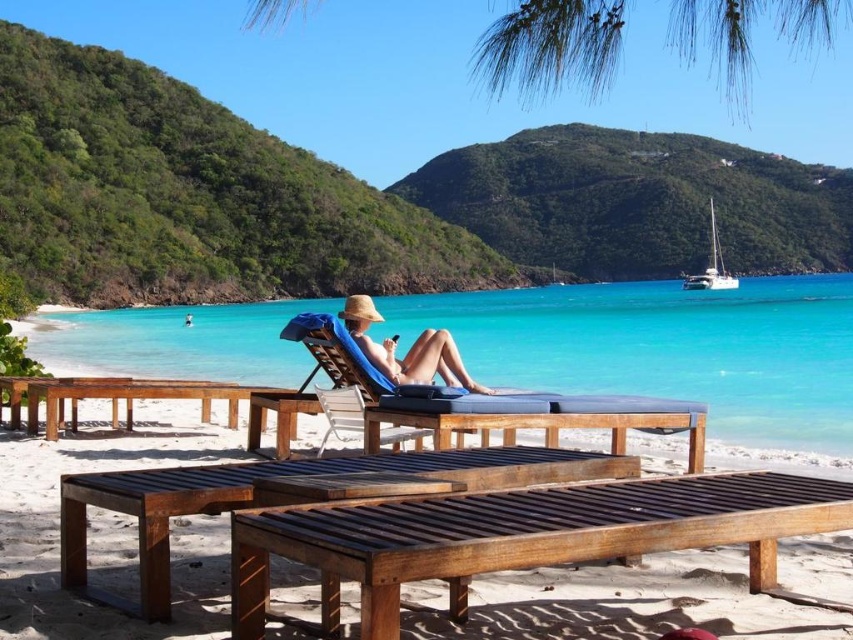
Based on the photo, you are a beachgoer who wants to set up your beach umbrella between the brown wooden picnic table at center and the blue fabric beach chair at center. Based on their positions, where should you place the umbrella so it is between them?

The brown wooden picnic table at center is below the blue fabric beach chair at center, so you should place the umbrella between them by positioning it above the picnic table and below the beach chair.

You are planning to set up a photography tripod that requires a flat surface at least 30 cm in height. You have two options in the scene, the brown wooden lounge chair at center and the blue fabric beach chair at center. Which chair would be suitable for placing the tripod?

The blue fabric beach chair at center has a greater height than the brown wooden lounge chair at center, so it would be suitable for placing the tripod as it meets the minimum 30 cm height requirement.

You are a beachgoer who wants to place your beach umbrella between the brown wooden bench at center and the blue fabric beach chair at center. Given that the recommended distance for a beach umbrella is 2 meters, can you fit it between them?

The distance between the brown wooden bench at center and the blue fabric beach chair at center is 3.52 meters, which is greater than the recommended 2 meters for a beach umbrella. Therefore, you can comfortably place the umbrella between them.